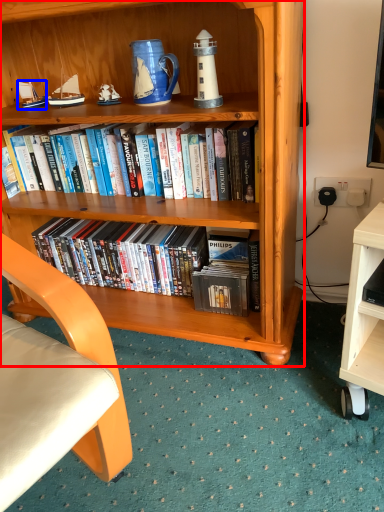
Question: Which object appears farthest to the camera in this image, bookcase (highlighted by a red box) or sailboat (highlighted by a blue box)?

Choices:
 (A) bookcase
 (B) sailboat

Answer: (B)